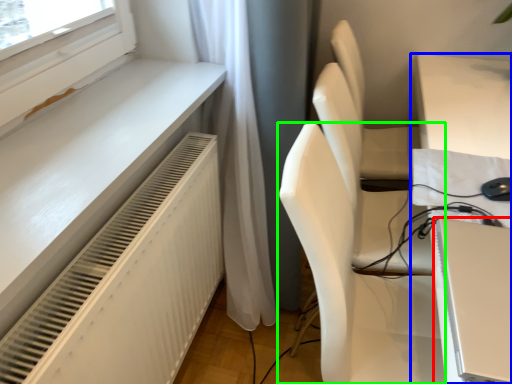
Question: Estimate the real-world distances between objects in this image. Which object is closer to computer (highlighted by a red box), table (highlighted by a blue box) or chair (highlighted by a green box)?

Choices:
 (A) table
 (B) chair

Answer: (B)